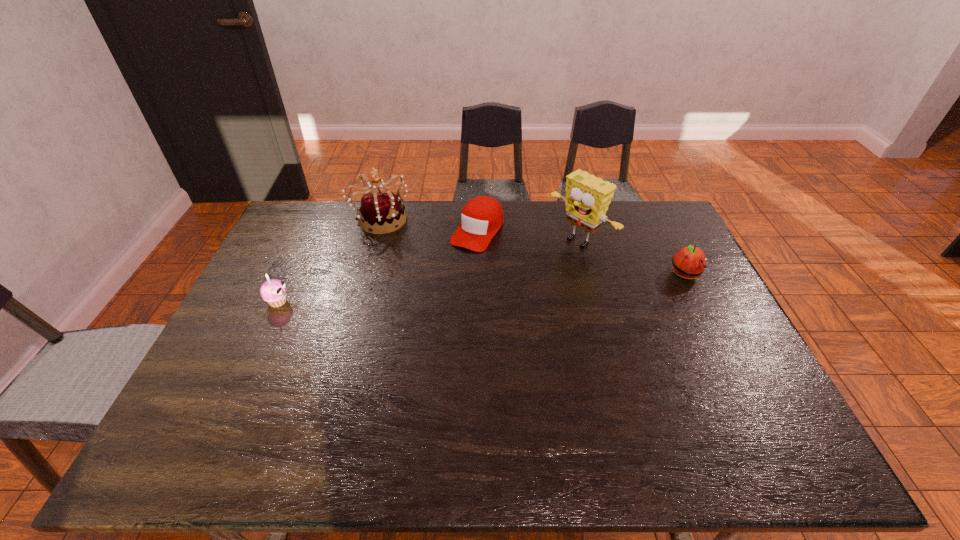
Find the location of `vacant point that satisfies the following two spatial constraints: 1. on the front side of the fourth farthest object; 2. on the right side of the baseball cap`. vacant point that satisfies the following two spatial constraints: 1. on the front side of the fourth farthest object; 2. on the right side of the baseball cap is located at coordinates (477, 275).

Image resolution: width=960 pixels, height=540 pixels. What are the coordinates of `vacant area in the image that satisfies the following two spatial constraints: 1. on the front side of the rightmost object; 2. on the right side of the baseball cap` in the screenshot? It's located at (477, 275).